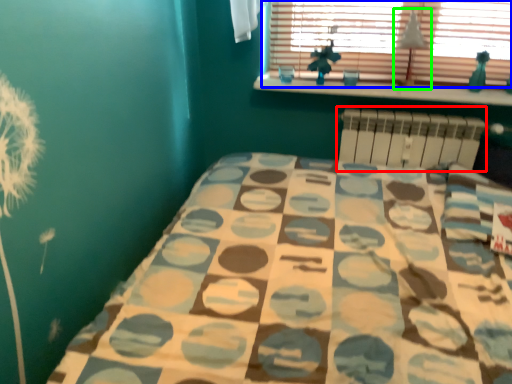
Question: Which is nearer to the radiator (highlighted by a red box)? window (highlighted by a blue box) or lamp (highlighted by a green box).

Choices:
 (A) window
 (B) lamp

Answer: (B)